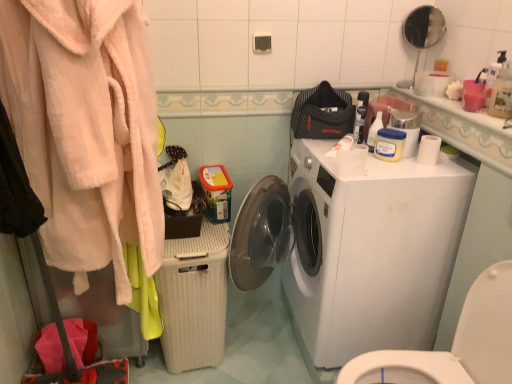
Question: Is soft pink plush robe at left taller or shorter than white matte toilet paper at upper right?

Choices:
 (A) tall
 (B) short

Answer: (A)

Question: In terms of width, does soft pink plush robe at left look wider or thinner when compared to white matte toilet paper at upper right?

Choices:
 (A) thin
 (B) wide

Answer: (B)

Question: Estimate the real-world distances between objects in this image. Which object is closer to the white matte toilet paper at upper right?

Choices:
 (A) white plastic washer at right
 (B) matte plastic container at upper right
 (C) white glossy washing machine at center
 (D) translucent plastic spray bottle at upper right, which is counted as the 1th cleaning product, starting from the front
 (E) translucent plastic spray bottle at upper right, the second cleaning product in the right-to-left sequence

Answer: (B)

Question: Which of these objects is positioned closest to the soft pink plush robe at left?

Choices:
 (A) matte plastic container at upper right
 (B) beige wicker basket at lower center
 (C) white matte toilet paper at upper right
 (D) white plastic washer at right
 (E) white glossy washing machine at center

Answer: (B)